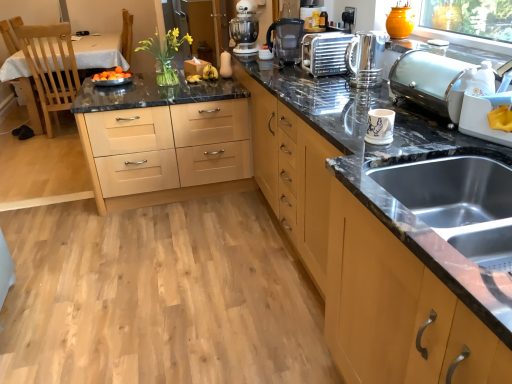
What are the coordinates of `vacant space that is to the left of satin silver toaster at upper right, the 2th appliance in the back-to-front sequence` in the screenshot? It's located at (369, 118).